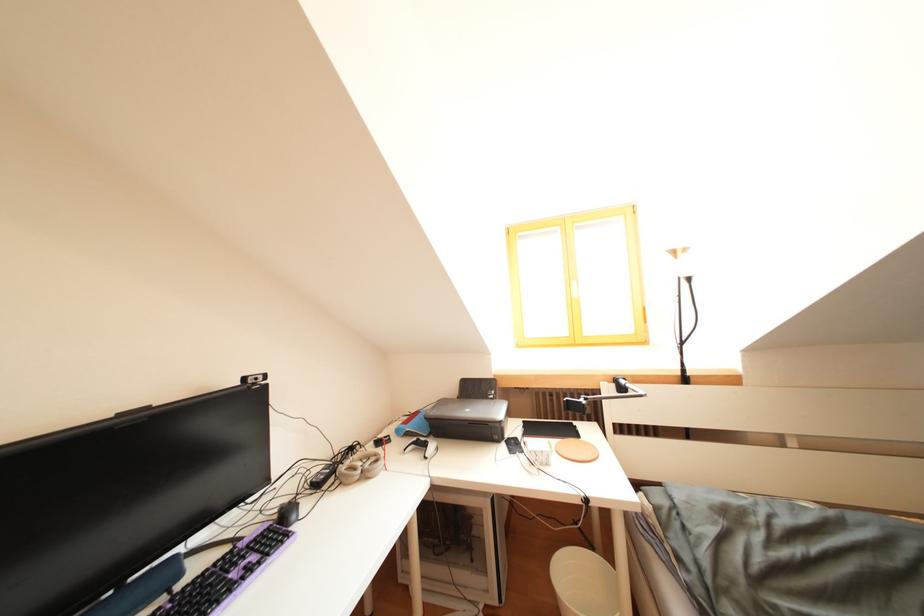
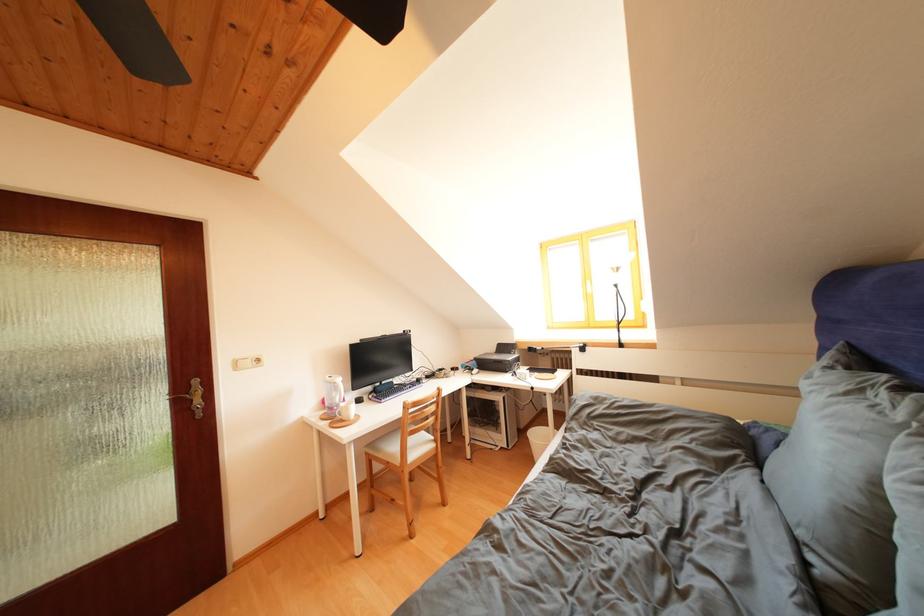
The images are taken continuously from a first-person perspective. In which direction are you moving?

The cameraman walked toward right, backward.